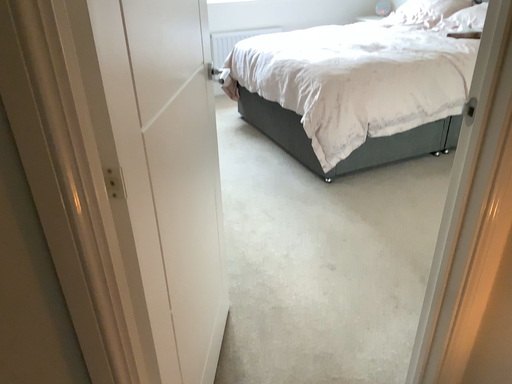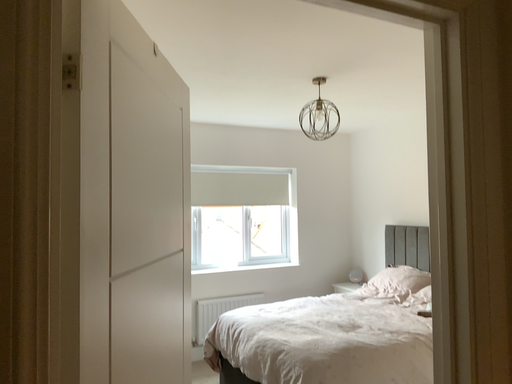
Question: Which way did the camera rotate in the video?

Choices:
 (A) rotated upward
 (B) rotated downward

Answer: (A)